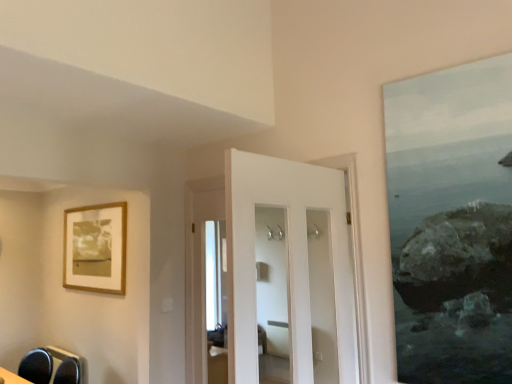
Question: Is point (76, 231) closer or farther from the camera than point (236, 210)?

Choices:
 (A) closer
 (B) farther

Answer: (B)

Question: Considering the relative positions of wooden frame at upper left and white glossy door at center in the image provided, is wooden frame at upper left to the left or to the right of white glossy door at center?

Choices:
 (A) right
 (B) left

Answer: (B)

Question: Which object is the farthest from the white glossy door at center?

Choices:
 (A) wooden frame at upper left
 (B) matte black swivel chair at lower left

Answer: (B)

Question: Which of these objects is positioned farthest from the matte black swivel chair at lower left?

Choices:
 (A) wooden frame at upper left
 (B) white glossy door at center

Answer: (B)